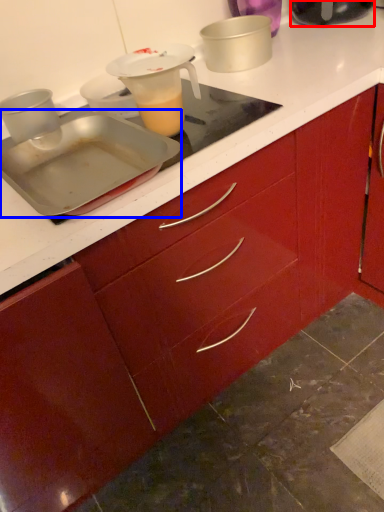
Question: Which of the following is the closest to the observer, kitchen appliance (highlighted by a red box) or kitchen appliance (highlighted by a blue box)?

Choices:
 (A) kitchen appliance
 (B) kitchen appliance

Answer: (B)